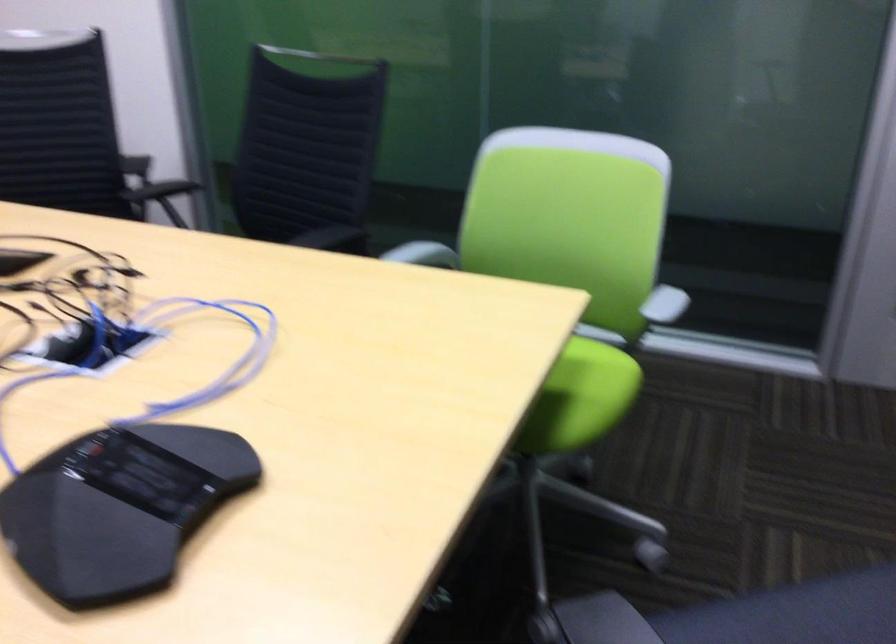
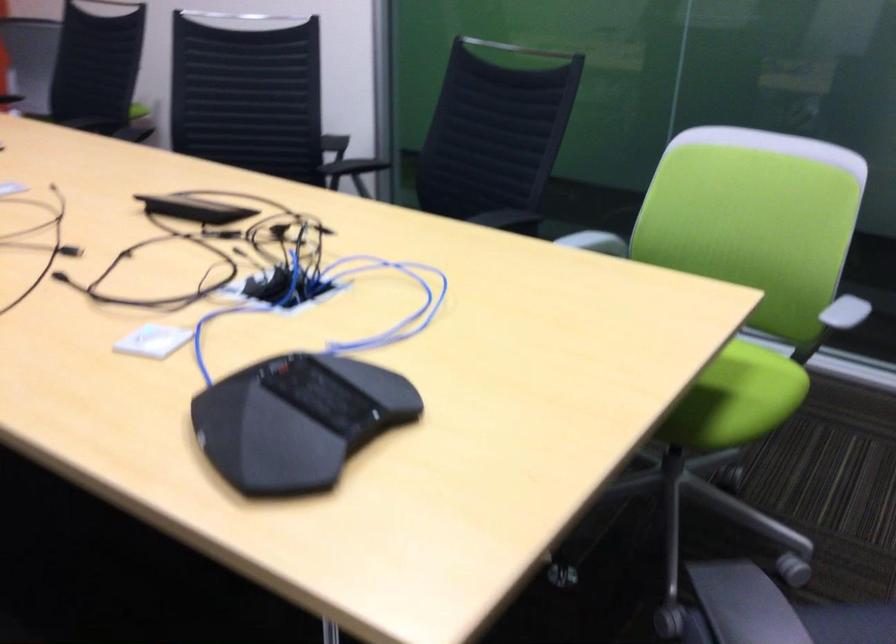
Question: The camera is either moving clockwise (left) or counter-clockwise (right) around the object. The first image is from the beginning of the video and the second image is from the end. Is the camera moving left or right when shooting the video?

Choices:
 (A) Left
 (B) Right

Answer: (B)